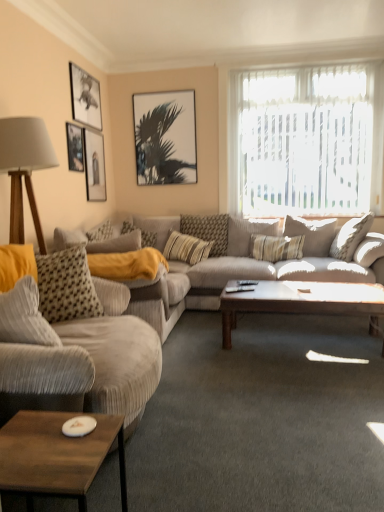
Find the location of a particular element. This screenshot has height=512, width=384. vacant region above matte black picture frame at upper left, which appears as the 3th picture frame when viewed from the right (from a real-world perspective) is located at coordinates (82, 72).